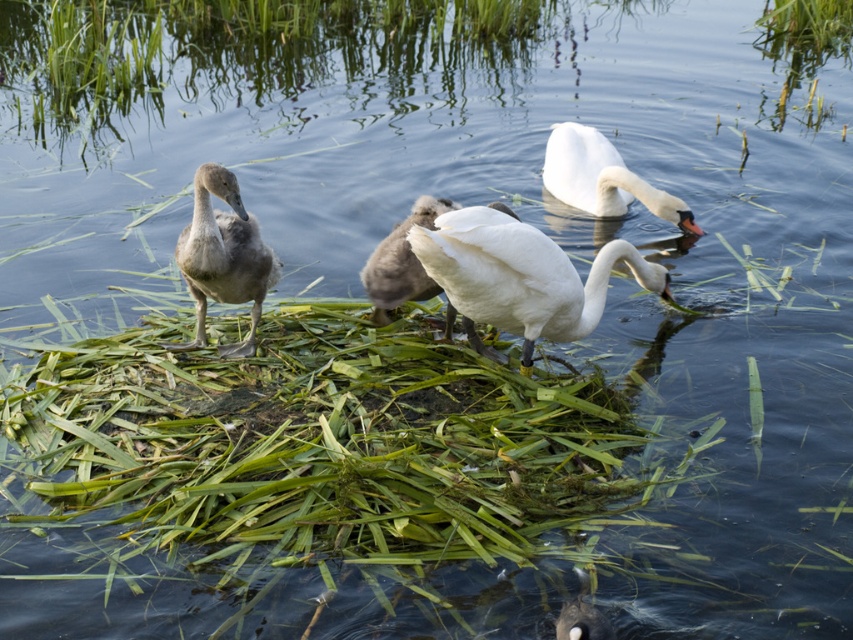
You are a birdwatcher observing the swans from a nearby dock. You see the white glossy swan at upper center and the white matte swan at center. Which swan is located to the right of the other?

The white glossy swan at upper center is positioned on the right side of the white matte swan at center.

You are a small boat operator who needs to navigate between the gray downy duckling at left and the white glossy swan at upper center. The boat requires a minimum of 10 feet of space to safely pass between two objects. Can you safely navigate your boat between them?

The gray downy duckling at left and the white glossy swan at upper center are 9.40 feet apart from each other. Since the boat requires a minimum of 10 feet to safely pass, the distance is insufficient. Therefore, navigating the boat between them is not safe.

You are standing on the edge of the water and see the white glossy swan at center. If you want to throw a small pebble to the swan without disturbing it, and you know that the swan will be startled if the pebble lands within 3 meters of it, what is the minimum distance you should aim to keep the pebble from the swan?

The white glossy swan at center is 3.66 meters away from the viewer. To avoid startling it, the pebble must land at least 3 meters away from the swan. Therefore, the minimum safe distance from the swan would be 3 meters. However, since the swan is already 3.66 meters away, you can aim to land the pebble just beyond the 3 meter threshold, maintaining a minimum distance of 3 meters from the swan.